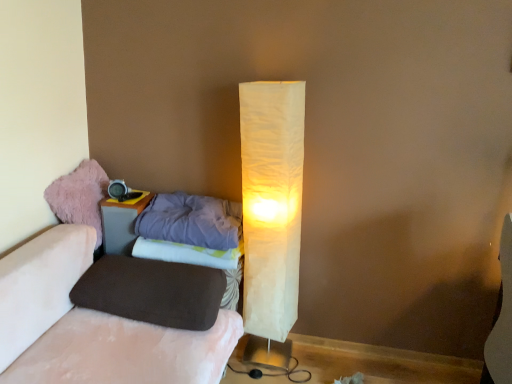
Question: Is matte gray nightstand at left inside fuzzy pink bean bag at left?

Choices:
 (A) no
 (B) yes

Answer: (A)

Question: Is fuzzy pink bean bag at left positioned with its back to matte gray nightstand at left?

Choices:
 (A) yes
 (B) no

Answer: (B)

Question: Considering the relative sizes of fuzzy pink bean bag at left and matte gray nightstand at left in the image provided, is fuzzy pink bean bag at left shorter than matte gray nightstand at left?

Choices:
 (A) no
 (B) yes

Answer: (B)

Question: Is fuzzy pink bean bag at left located outside matte gray nightstand at left?

Choices:
 (A) no
 (B) yes

Answer: (B)

Question: From a real-world perspective, is fuzzy pink bean bag at left physically above matte gray nightstand at left?

Choices:
 (A) no
 (B) yes

Answer: (B)

Question: Considering the relative sizes of fuzzy pink bean bag at left and matte gray nightstand at left in the image provided, is fuzzy pink bean bag at left wider than matte gray nightstand at left?

Choices:
 (A) yes
 (B) no

Answer: (A)

Question: Does white paper lamp at center turn towards fuzzy pink bean bag at left?

Choices:
 (A) no
 (B) yes

Answer: (A)

Question: Is white paper lamp at center at the left side of fuzzy pink bean bag at left?

Choices:
 (A) no
 (B) yes

Answer: (A)

Question: Considering the relative sizes of white paper lamp at center and fuzzy pink bean bag at left in the image provided, is white paper lamp at center wider than fuzzy pink bean bag at left?

Choices:
 (A) no
 (B) yes

Answer: (A)

Question: Is white paper lamp at center at the right side of fuzzy pink bean bag at left?

Choices:
 (A) no
 (B) yes

Answer: (B)

Question: Considering the relative sizes of white paper lamp at center and fuzzy pink bean bag at left in the image provided, is white paper lamp at center shorter than fuzzy pink bean bag at left?

Choices:
 (A) yes
 (B) no

Answer: (B)

Question: Are white paper lamp at center and fuzzy pink bean bag at left far apart?

Choices:
 (A) yes
 (B) no

Answer: (B)

Question: From a real-world perspective, is fuzzy pink bean bag at left on purple soft pillow at left, marked as the first pillow in a top-to-bottom arrangement?

Choices:
 (A) yes
 (B) no

Answer: (A)